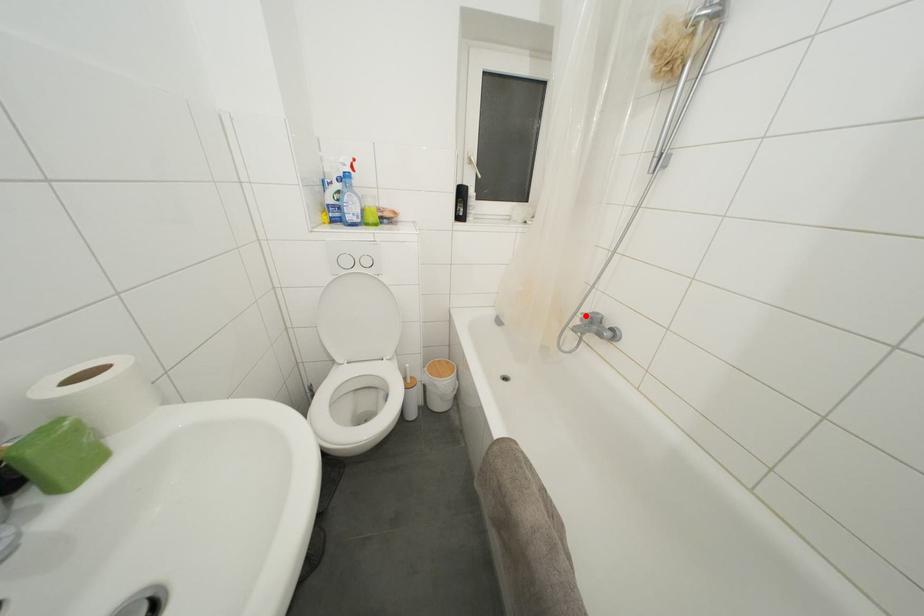
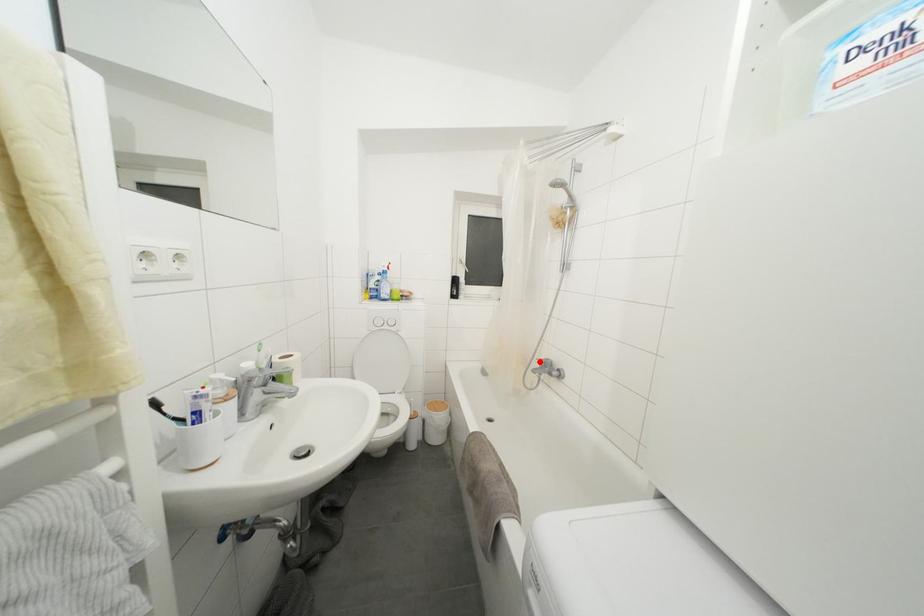
I am providing you with two images of the same scene from different viewpoints. A red point is marked on the first image and another point is marked on the second image. Is the marked point in image1 the same physical position as the marked point in image2?

Yes